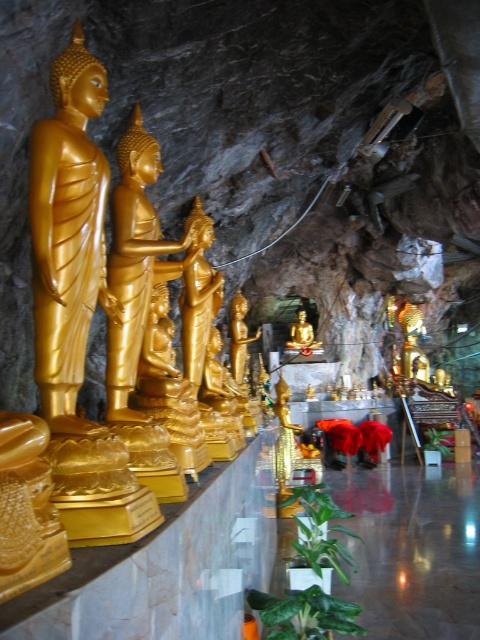
You are a visitor standing in the cave temple and want to take a photo of both the gold polished statue at left and the gold polished statue at center. However, you notice that one statue is blocking the view of the other. Which statue is blocking the other one?

The gold polished statue at left is positioned over the gold polished statue at center, so the gold polished statue at left is blocking the view of the gold polished statue at center.

You are standing in the cave temple and want to locate the gold polished statue at left. According to the coordinates provided, where exactly is it positioned?

The gold polished statue at left is positioned at the 2D coordinates of point (68, 234).